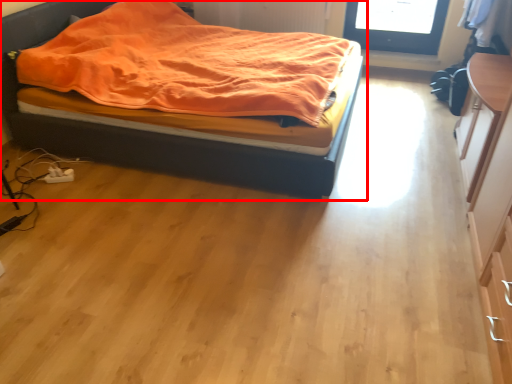
Question: Considering the relative positions of bed (annotated by the red box) and dresser in the image provided, where is bed (annotated by the red box) located with respect to the staircase?

Choices:
 (A) right
 (B) left

Answer: (B)